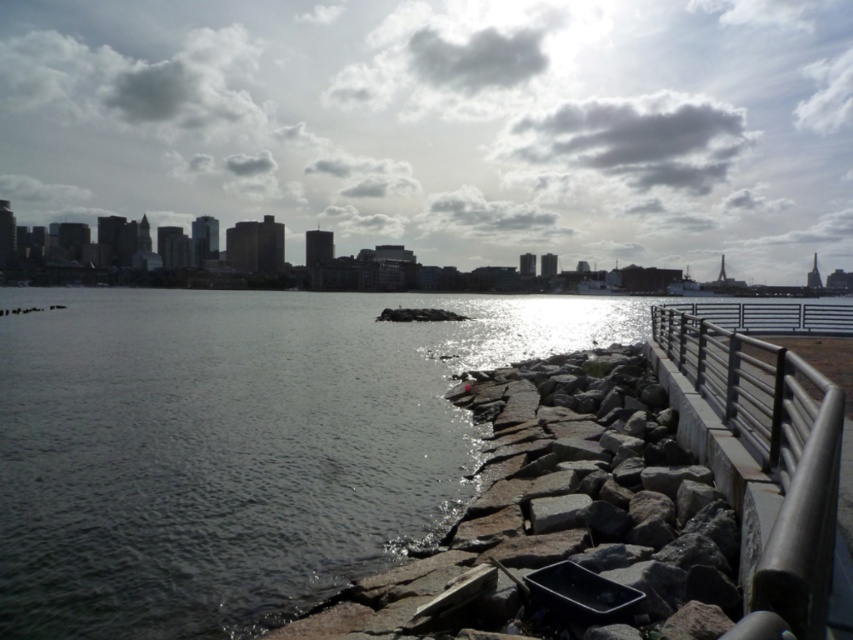
You are standing on the walkway and want to take a photo of the dark gray water at center and the satin silver railing at right. Which object will appear closer to the camera in the photo?

The dark gray water at center will appear closer to the camera in the photo because it is further to the viewer than the satin silver railing at right, meaning it is positioned nearer to the camera compared to the railing.

You are a maintenance worker inspecting the waterfront area. You need to determine if the dark gray water at center can overflow onto the walkway during high tide. Based on their positions, can the water reach the satin silver railing at right?

The dark gray water at center is above the satin silver railing at right, meaning the water level is already higher than the railing. Therefore, during high tide, the water could easily overflow onto the walkway and reach the satin silver railing at right.